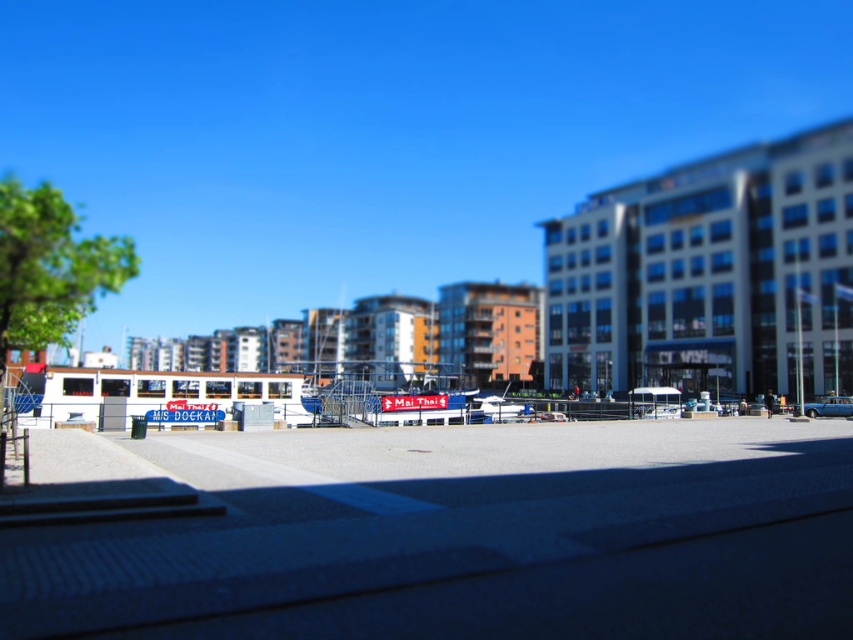
You are a pedestrian standing on the walkway and want to cross to the marina. There is a silver metallic car at center and a blue metallic car at center blocking your path. Which car should you move to get to the marina first?

The silver metallic car at center is to the left of blue metallic car at center, so you should move the silver metallic car at center first to reach the marina as it is closer to your starting position on the walkway.

You are a parking attendant who needs to fit both the silver metallic car at center and the blue metallic car at center into a parking space that is 2 meters wide. Based on their widths, which car should be parked first to ensure both fit?

The silver metallic car at center has a smaller width than the blue metallic car at center, so you should park the silver metallic car at center first, then the blue metallic car at center to ensure both fit within the 2 meters width.